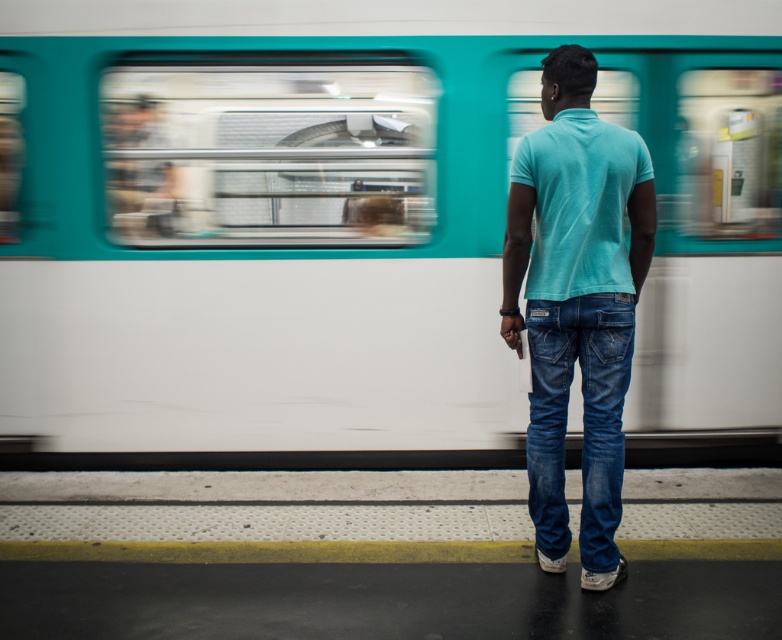
Between light blue cotton shirt at center and turquoise cotton polo at center, which one appears on the left side from the viewer's perspective?

turquoise cotton polo at center is more to the left.

Who is more distant from viewer, (x=547, y=260) or (x=551, y=147)?

Point (x=547, y=260)

At what (x,y) coordinates should I click in order to perform the action: click on light blue cotton shirt at center. Please return your answer as a coordinate pair (x, y). Looking at the image, I should click on (576, 301).

Is point (653, 144) positioned before point (597, 280)?

No.

Find the location of a particular element. This screenshot has height=640, width=782. teal glossy train at center is located at coordinates (361, 227).

Is point (734, 52) closer to viewer compared to point (605, 225)?

No, it is behind (605, 225).

The image size is (782, 640). Find the location of `teal glossy train at center`. teal glossy train at center is located at coordinates (361, 227).

Who is positioned more to the right, teal glossy train at center or denim jeans at center?

Positioned to the right is denim jeans at center.

Does point (16, 259) lie in front of point (533, 422)?

No, it is behind (533, 422).

Is point (117, 220) positioned after point (558, 451)?

Yes, point (117, 220) is behind point (558, 451).

In order to click on teal glossy train at center in this screenshot , I will do `click(361, 227)`.